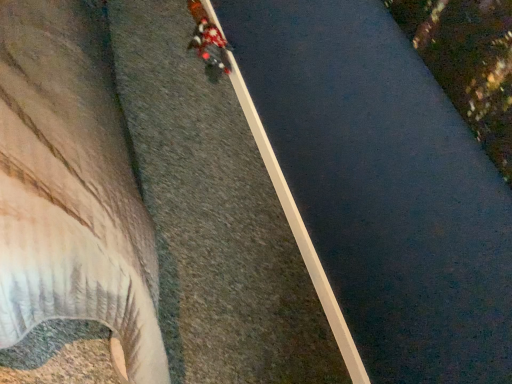
Question: Is red fabric jacket at upper center situated inside smooth concrete waterway at center or outside?

Choices:
 (A) outside
 (B) inside

Answer: (A)

Question: Is red fabric jacket at upper center wider or thinner than smooth concrete waterway at center?

Choices:
 (A) thin
 (B) wide

Answer: (B)

Question: Based on their sizes in the image, would you say red fabric jacket at upper center is bigger or smaller than smooth concrete waterway at center?

Choices:
 (A) small
 (B) big

Answer: (B)

Question: Would you say smooth concrete waterway at center is to the left or to the right of red fabric jacket at upper center in the picture?

Choices:
 (A) right
 (B) left

Answer: (A)

Question: From the image's perspective, is smooth concrete waterway at center located above or below red fabric jacket at upper center?

Choices:
 (A) above
 (B) below

Answer: (B)

Question: Considering their positions, is smooth concrete waterway at center located in front of or behind red fabric jacket at upper center?

Choices:
 (A) front
 (B) behind

Answer: (A)

Question: Considering the positions of smooth concrete waterway at center and red fabric jacket at upper center in the image, is smooth concrete waterway at center wider or thinner than red fabric jacket at upper center?

Choices:
 (A) thin
 (B) wide

Answer: (A)